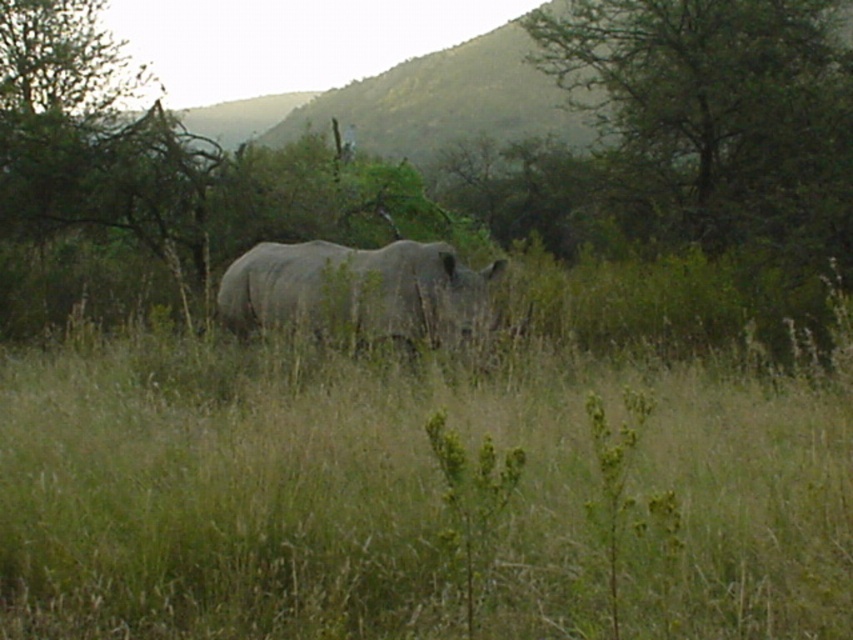
Looking at this image, can you confirm if green leafy tree at upper right is wider than gray matte rhinoceros at center?

Indeed, green leafy tree at upper right has a greater width compared to gray matte rhinoceros at center.

Which is above, green leafy tree at upper right or gray matte rhinoceros at center?

green leafy tree at upper right

Does point (727, 218) come in front of point (370, 320)?

That is False.

Where is `green leafy tree at upper right`? green leafy tree at upper right is located at coordinates (715, 113).